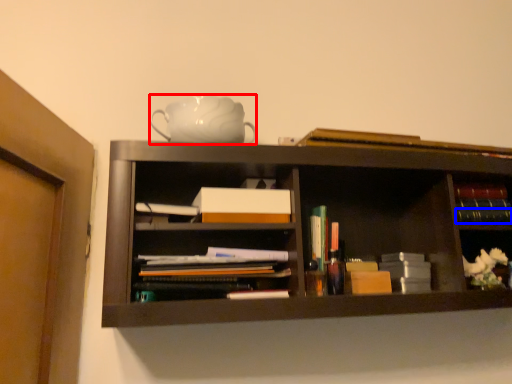
Question: Which point is closer to the camera, teapot (highlighted by a red box) or book (highlighted by a blue box)?

Choices:
 (A) teapot
 (B) book

Answer: (A)